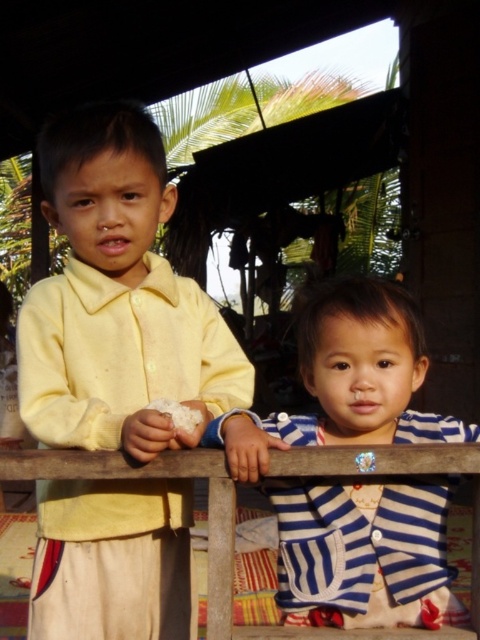
Who is positioned more to the right, yellow matte shirt at left or wooden at center?

wooden at center is more to the right.

Which is in front, point (45, 525) or point (305, 460)?

Point (305, 460) is in front.

I want to click on yellow matte shirt at left, so pyautogui.click(x=118, y=300).

Who is lower down, yellow matte shirt at left or blue striped shirt at center?

Positioned lower is blue striped shirt at center.

Is point (79, 586) farther from viewer compared to point (373, 358)?

Yes, point (79, 586) is farther from viewer.

Which is behind, point (124, 625) or point (443, 577)?

The point (124, 625) is more distant.

Locate an element on the screen. Image resolution: width=480 pixels, height=640 pixels. yellow matte shirt at left is located at coordinates (118, 300).

Is blue striped shirt at center bigger than wooden at center?

Correct, blue striped shirt at center is larger in size than wooden at center.

Based on the photo, can you confirm if blue striped shirt at center is positioned below wooden at center?

Actually, blue striped shirt at center is above wooden at center.

The height and width of the screenshot is (640, 480). Identify the location of blue striped shirt at center. (346, 380).